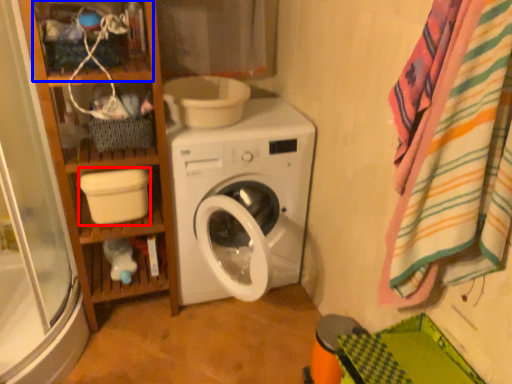
Question: Which of the following is the farthest to the observer, toilet bowl (highlighted by a red box) or shelf (highlighted by a blue box)?

Choices:
 (A) toilet bowl
 (B) shelf

Answer: (A)